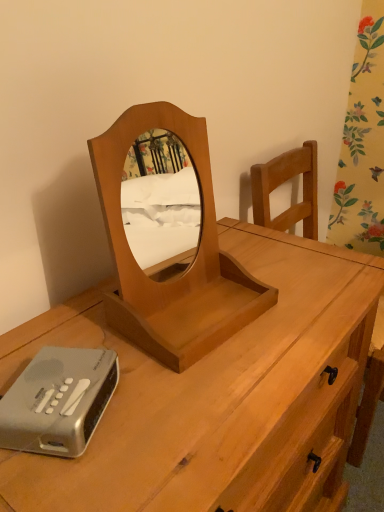
I want to click on free spot to the right of silver plastic alarm clock at lower left, so click(178, 411).